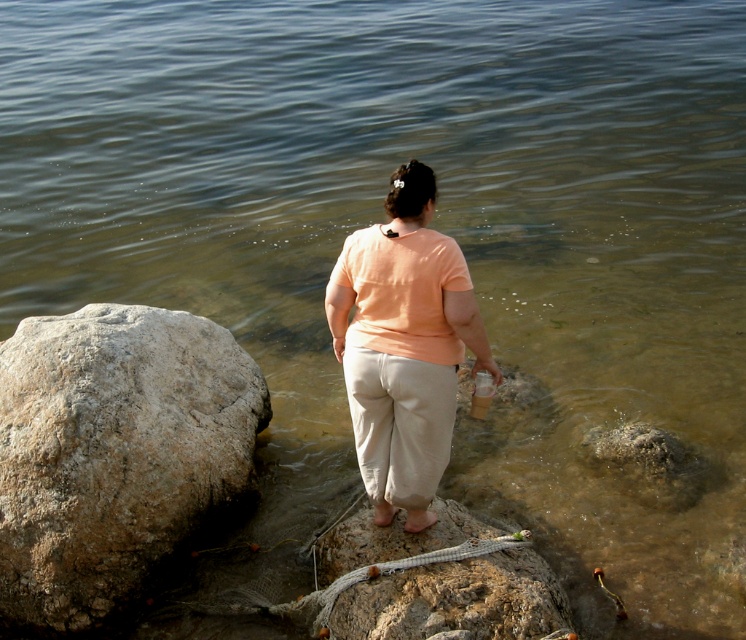
Question: Among these objects, which one is farthest from the camera?

Choices:
 (A) transparent plastic bottle at lower center
 (B) matte peach shirt at center
 (C) smooth gray rock at center

Answer: (A)

Question: Does matte peach shirt at center have a smaller size compared to transparent plastic bottle at lower center?

Choices:
 (A) yes
 (B) no

Answer: (B)

Question: Does matte peach shirt at center have a lesser width compared to smooth gray rock at center?

Choices:
 (A) no
 (B) yes

Answer: (B)

Question: Which of these objects is positioned farthest from the smooth gray rock at center?

Choices:
 (A) matte peach shirt at center
 (B) gray rough rock at left

Answer: (B)

Question: Which point is closer to the camera taking this photo?

Choices:
 (A) (345, 547)
 (B) (486, 385)

Answer: (B)

Question: Does matte peach shirt at center appear on the left side of smooth gray rock at center?

Choices:
 (A) no
 (B) yes

Answer: (B)